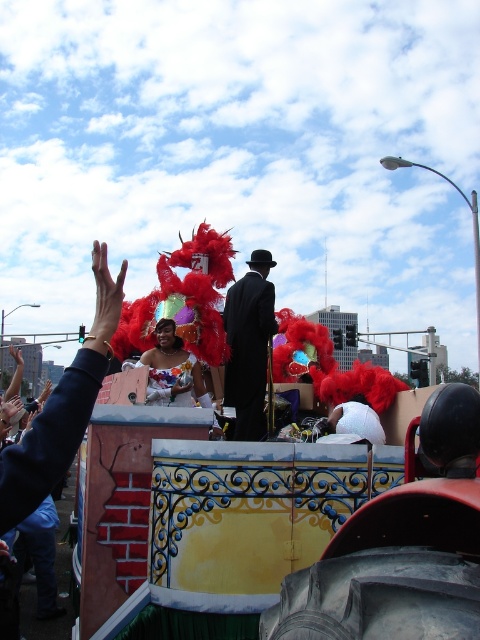
You are a photographer at the parade and want to ensure both the black satin suit at center and the matte white dress at center are clearly visible in your photo. Given their sizes, which one should you focus on first to ensure proper framing?

The black satin suit at center has a larger size compared to the matte white dress at center, so you should focus on the black satin suit at center first to ensure proper framing.

You are a photographer trying to capture the float from the front. The float has two central elements, the black satin suit at center and the matte white dress at center. Which one is positioned higher up when viewed from the front?

The black satin suit at center is located above the matte white dress at center, so it is positioned higher up when viewed from the front.